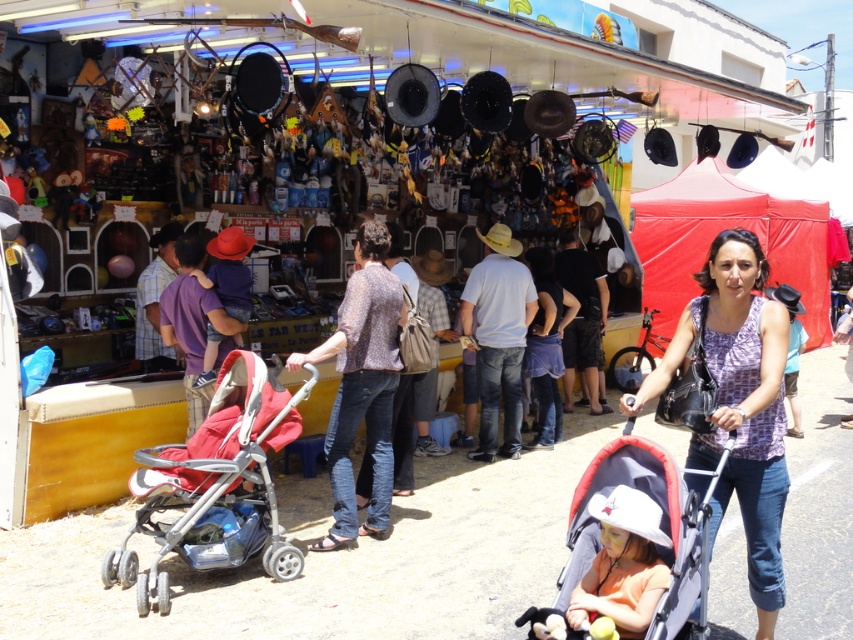
You are a photographer at the market and want to capture both the printed fabric blouse at center and the red fabric stroller at center in your photo. Which object will appear larger in the photo?

The printed fabric blouse at center will appear larger in the photo because it is closer to the viewer than the red fabric stroller at center.